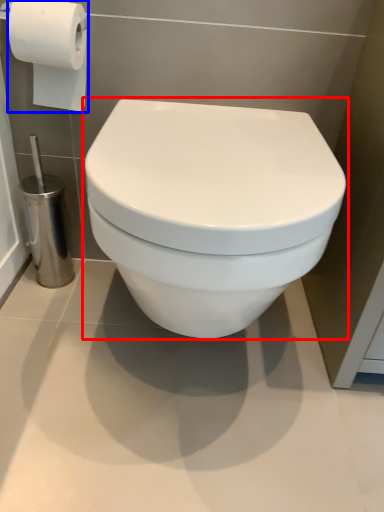
Question: Which object appears closest to the camera in this image, toilet (highlighted by a red box) or toilet paper (highlighted by a blue box)?

Choices:
 (A) toilet
 (B) toilet paper

Answer: (A)